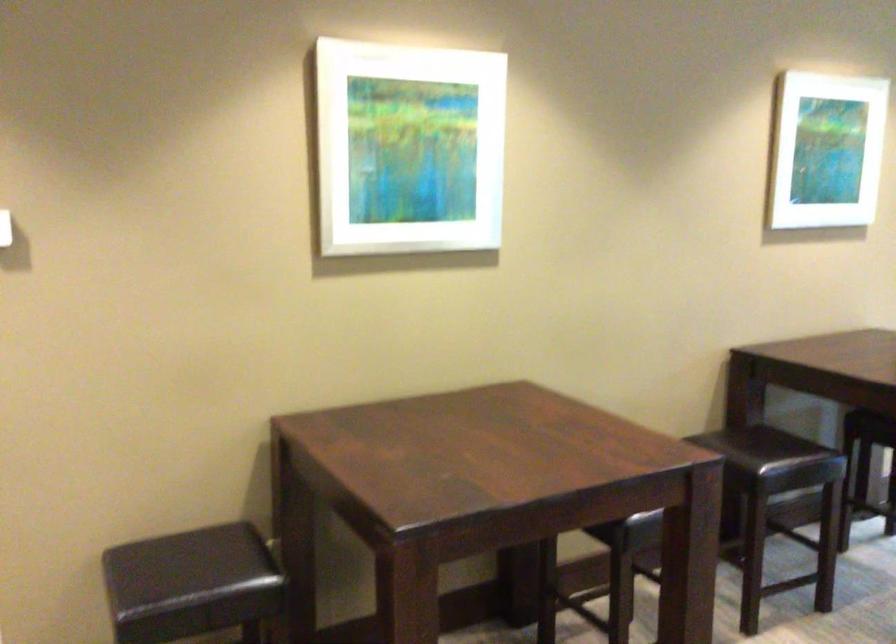
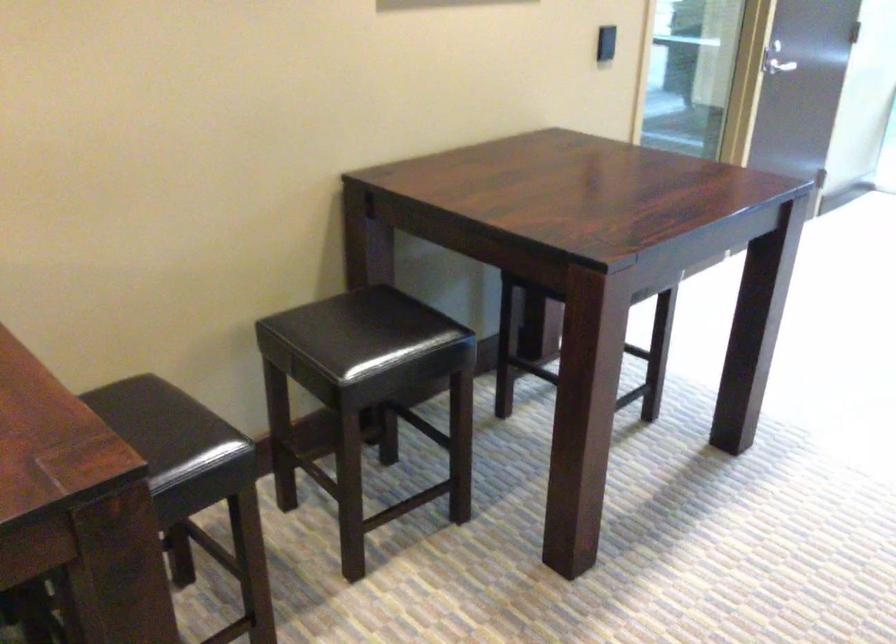
The images are taken continuously from a first-person perspective. In which direction are you moving?

The cameraman walked toward right, forward.